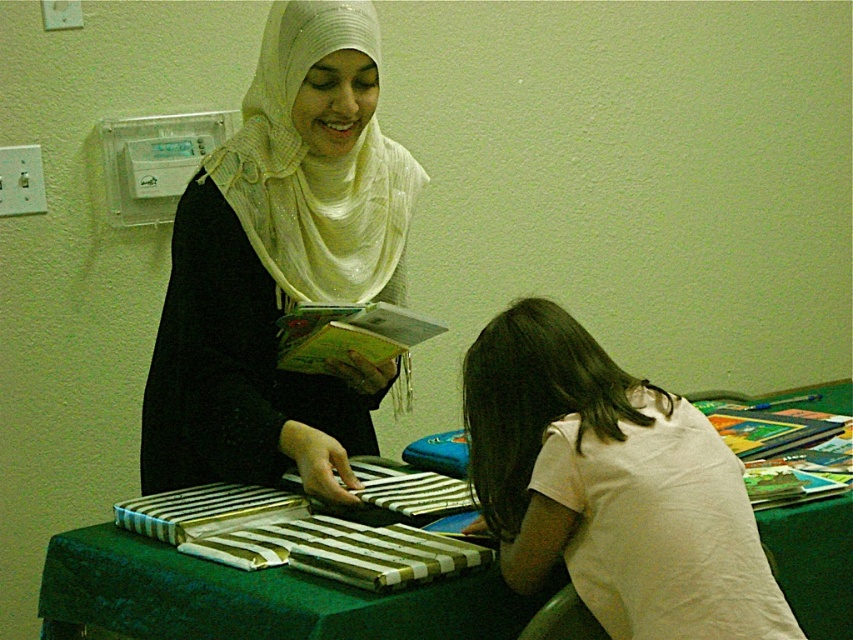
Does matte white hijab at upper center have a larger size compared to hardcover book at center?

Result: Yes, matte white hijab at upper center is bigger than hardcover book at center.

How far apart are matte white hijab at upper center and hardcover book at center?

matte white hijab at upper center and hardcover book at center are 15.72 centimeters apart from each other.

Which is in front, point (247, 241) or point (277, 353)?

Point (247, 241) is more forward.

Image resolution: width=853 pixels, height=640 pixels. What are the coordinates of `matte white hijab at upper center` in the screenshot? It's located at (280, 266).

Is white cotton shirt at lower right to the right of green fabric table at center from the viewer's perspective?

Indeed, white cotton shirt at lower right is positioned on the right side of green fabric table at center.

Is white cotton shirt at lower right bigger than green fabric table at center?

Correct, white cotton shirt at lower right is larger in size than green fabric table at center.

Identify the location of white cotton shirt at lower right. (611, 486).

Does white cotton shirt at lower right have a larger size compared to hardcover book at center?

Yes.

Is point (635, 492) positioned in front of point (404, 310)?

Yes, point (635, 492) is closer to viewer.

Which is behind, point (596, 461) or point (349, 324)?

Positioned behind is point (349, 324).

The width and height of the screenshot is (853, 640). I want to click on white cotton shirt at lower right, so click(611, 486).